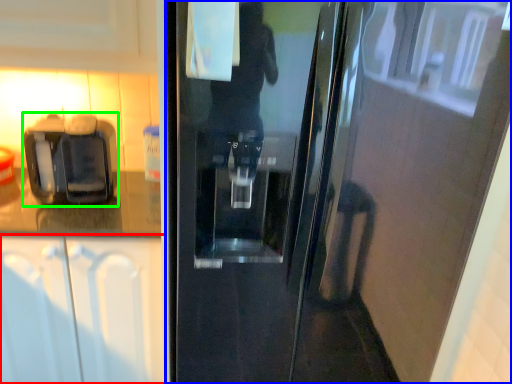
Question: Which object is the farthest from cabinetry (highlighted by a red box)? Choose among these: door (highlighted by a blue box) or coffee machine (highlighted by a green box).

Choices:
 (A) door
 (B) coffee machine

Answer: (A)